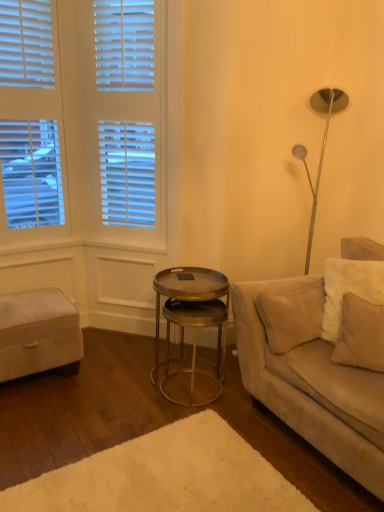
I want to click on white fabric ottoman at lower left, so click(x=38, y=333).

At what (x,y) coordinates should I click in order to perform the action: click on beige fabric pillow at right. Please return your answer as a coordinate pair (x, y). Looking at the image, I should click on (361, 335).

This screenshot has height=512, width=384. What do you see at coordinates (316, 370) in the screenshot?
I see `suede beige couch at right` at bounding box center [316, 370].

Find the location of `white fabric ottoman at lower left`. white fabric ottoman at lower left is located at coordinates (38, 333).

Consider the image. Which point is more forward, (376, 346) or (35, 347)?

The point (376, 346) is in front.

Where is `pillow that appears in front of the white fabric ottoman at lower left`? pillow that appears in front of the white fabric ottoman at lower left is located at coordinates (361, 335).

Is beige fabric pillow at right at the left side of white fabric ottoman at lower left?

No.

Considering the positions of objects beige fabric pillow at right and white fabric ottoman at lower left in the image provided, who is in front, beige fabric pillow at right or white fabric ottoman at lower left?

beige fabric pillow at right is more forward.

Considering the positions of points (372, 319) and (371, 312), is point (372, 319) farther from camera compared to point (371, 312)?

No, it is not.

Where is `studio couch lying on the right of beige fabric pillow at right`? This screenshot has width=384, height=512. studio couch lying on the right of beige fabric pillow at right is located at coordinates (316, 370).

Is beige fabric pillow at right at the back of suede beige couch at right?

Correct, suede beige couch at right is looking away from beige fabric pillow at right.

From the picture: Measure the distance from suede beige couch at right to beige fabric pillow at right.

suede beige couch at right is 8.16 inches away from beige fabric pillow at right.

Is white plush rug at lower center turned away from metallic gold side table at center?

No, white plush rug at lower center is not facing away from metallic gold side table at center.

Does point (106, 466) appear closer or farther from the camera than point (156, 331)?

Point (106, 466) is closer to the camera than point (156, 331).

Looking at this image, from a real-world perspective, is white plush rug at lower center physically above metallic gold side table at center?

No, from a real-world perspective, white plush rug at lower center is not on top of metallic gold side table at center.

Can you confirm if white plush rug at lower center is taller than metallic gold side table at center?

No, white plush rug at lower center is not taller than metallic gold side table at center.

Is white plush rug at lower center oriented away from suede beige couch at right?

No, suede beige couch at right is not at the back of white plush rug at lower center.

Where is `plain below the suede beige couch at right (from a real-world perspective)`? The image size is (384, 512). plain below the suede beige couch at right (from a real-world perspective) is located at coordinates coord(165,476).

Is white plush rug at lower center directly adjacent to suede beige couch at right?

white plush rug at lower center and suede beige couch at right are clearly separated.

Which object is positioned more to the right, white plush rug at lower center or suede beige couch at right?

suede beige couch at right.

Is metallic gold side table at center not inside white fabric ottoman at lower left?

Absolutely, metallic gold side table at center is external to white fabric ottoman at lower left.

Is metallic gold side table at center to the right of white fabric ottoman at lower left from the viewer's perspective?

Correct, you'll find metallic gold side table at center to the right of white fabric ottoman at lower left.

In the scene shown: Looking at their sizes, would you say metallic gold side table at center is wider or thinner than white fabric ottoman at lower left?

Clearly, metallic gold side table at center has less width compared to white fabric ottoman at lower left.

Is metallic gold side table at center taller than white fabric ottoman at lower left?

Yes.

How many degrees apart are the facing directions of suede beige couch at right and white plush rug at lower center?

suede beige couch at right and white plush rug at lower center are facing 179 degrees away from each other.

Is suede beige couch at right directly adjacent to white plush rug at lower center?

No, suede beige couch at right is not with white plush rug at lower center.

Based on the photo, considering the sizes of suede beige couch at right and white plush rug at lower center in the image, is suede beige couch at right wider or thinner than white plush rug at lower center?

suede beige couch at right is thinner than white plush rug at lower center.

Which of these two, beige fabric pillow at right or suede beige couch at right, is smaller?

With smaller size is beige fabric pillow at right.

From a real-world perspective, which is physically above, beige fabric pillow at right or suede beige couch at right?

beige fabric pillow at right is physically above.

Which of these two, beige fabric pillow at right or suede beige couch at right, stands shorter?

With less height is beige fabric pillow at right.

Is beige fabric pillow at right positioned beyond the bounds of suede beige couch at right?

Actually, beige fabric pillow at right is within suede beige couch at right.

The width and height of the screenshot is (384, 512). In order to click on music stool located below the beige fabric pillow at right (from the image's perspective) in this screenshot , I will do 38,333.

Find the location of a particular element. studio couch that is in front of the beige fabric pillow at right is located at coordinates (316, 370).

When comparing their distances from white fabric ottoman at lower left, does white plush rug at lower center or metallic gold side table at center seem further?

white plush rug at lower center.

Which object lies nearer to the anchor point white fabric ottoman at lower left, metallic gold side table at center or suede beige couch at right?

The object closer to white fabric ottoman at lower left is metallic gold side table at center.

Based on their spatial positions, is white fabric ottoman at lower left or metallic gold side table at center closer to beige fabric pillow at right?

The object closer to beige fabric pillow at right is metallic gold side table at center.

Based on their spatial positions, is beige fabric pillow at right or white plush rug at lower center further from suede beige couch at right?

white plush rug at lower center is positioned further to the anchor suede beige couch at right.

Based on their spatial positions, is white fabric ottoman at lower left or suede beige couch at right closer to metallic gold side table at center?

The object closer to metallic gold side table at center is suede beige couch at right.

Based on their spatial positions, is white plush rug at lower center or beige fabric pillow at right closer to metallic gold side table at center?

beige fabric pillow at right is closer to metallic gold side table at center.

Estimate the real-world distances between objects in this image. Which object is further from white plush rug at lower center, suede beige couch at right or white fabric ottoman at lower left?

white fabric ottoman at lower left lies further to white plush rug at lower center than the other object.

From the picture: From the image, which object appears to be nearer to white fabric ottoman at lower left, suede beige couch at right or white plush rug at lower center?

white plush rug at lower center is positioned closer to the anchor white fabric ottoman at lower left.

Locate an element on the screen. This screenshot has width=384, height=512. desk situated between white fabric ottoman at lower left and suede beige couch at right from left to right is located at coordinates (185, 294).

Locate an element on the screen. The image size is (384, 512). pillow located between white plush rug at lower center and metallic gold side table at center in the depth direction is located at coordinates pyautogui.click(x=361, y=335).

At what (x,y) coordinates should I click in order to perform the action: click on pillow situated between metallic gold side table at center and suede beige couch at right from left to right. Please return your answer as a coordinate pair (x, y). The image size is (384, 512). Looking at the image, I should click on (361, 335).

Identify the location of plain situated between white fabric ottoman at lower left and suede beige couch at right from left to right. (165, 476).